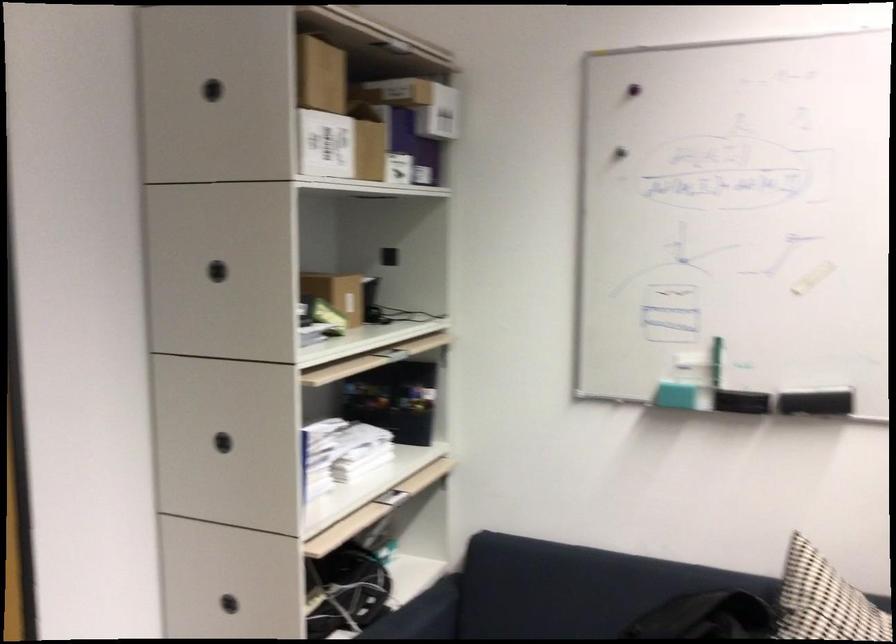
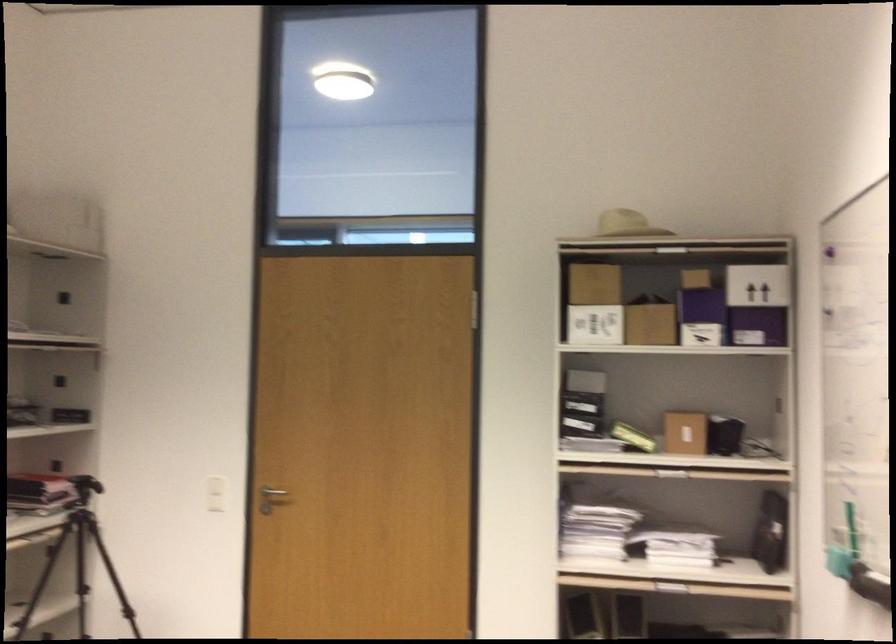
Find the pixel in the second image that matches the point at 337,303 in the first image.

(684, 431)